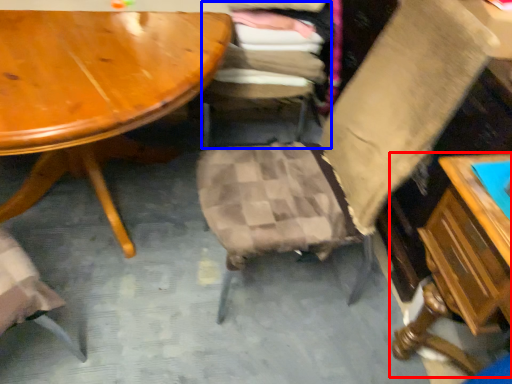
Question: Which of the following is the closest to the observer, table (highlighted by a red box) or chair (highlighted by a blue box)?

Choices:
 (A) table
 (B) chair

Answer: (A)